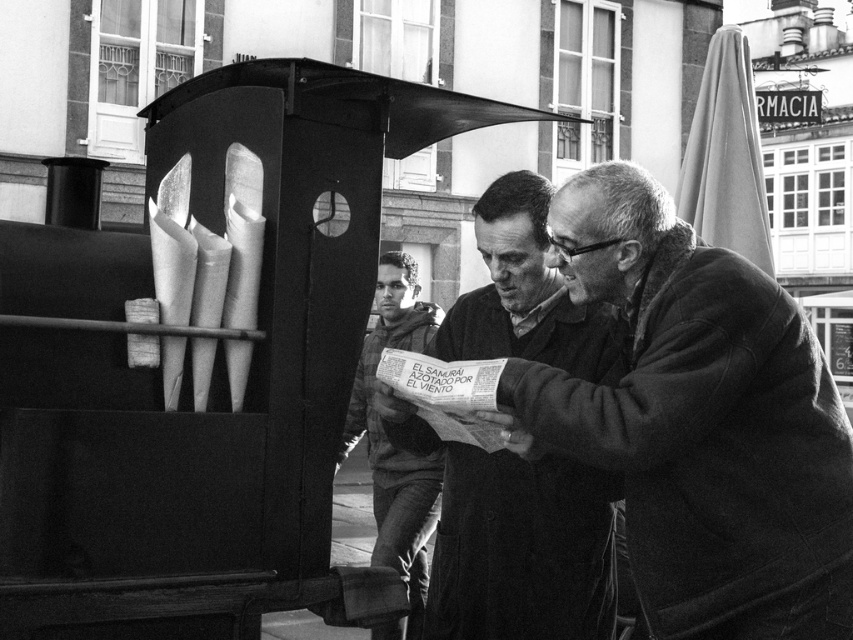
Question: Which point appears closest to the camera in this image?

Choices:
 (A) (381, 275)
 (B) (750, 352)
 (C) (265, 77)
 (D) (463, 468)

Answer: (B)

Question: Which point is closer to the camera?

Choices:
 (A) (701, 465)
 (B) (416, 547)

Answer: (A)

Question: Does smooth leather jacket at center appear over dark gray hoodie at center?

Choices:
 (A) yes
 (B) no

Answer: (B)

Question: Which of these objects is positioned farthest from the smooth leather jacket at center?

Choices:
 (A) metallic bus stop at center
 (B) dark woolen sweater at center
 (C) dark gray hoodie at center

Answer: (A)

Question: Can you confirm if dark woolen sweater at center is positioned to the left of dark gray hoodie at center?

Choices:
 (A) yes
 (B) no

Answer: (B)

Question: Can you confirm if dark woolen sweater at center is positioned to the right of dark gray hoodie at center?

Choices:
 (A) no
 (B) yes

Answer: (B)